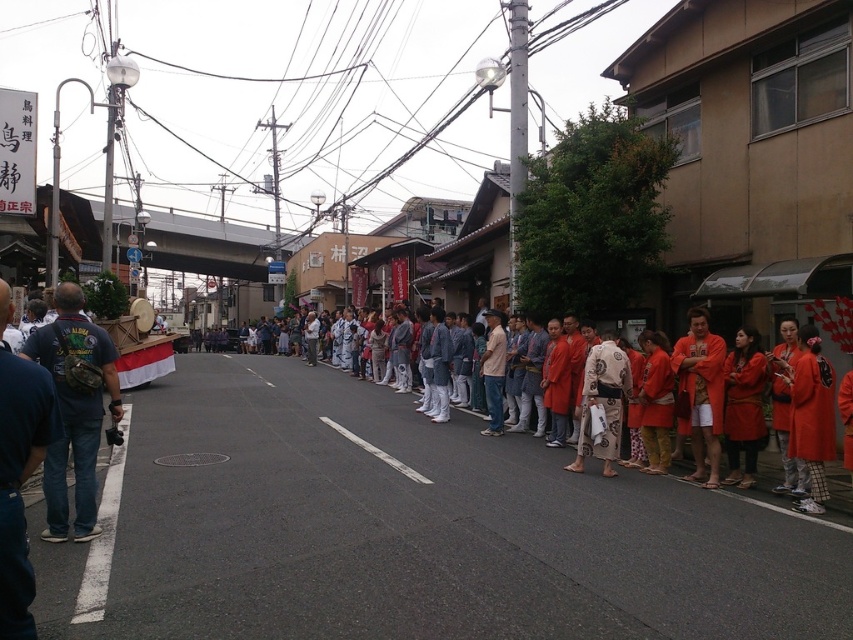
Question: Can you confirm if orange cotton kimono at center is positioned to the right of blue jeans at lower left?

Choices:
 (A) yes
 (B) no

Answer: (A)

Question: Can you confirm if dark blue denim jeans at lower left is positioned to the right of red kimono at center?

Choices:
 (A) yes
 (B) no

Answer: (A)

Question: In this image, where is light brown cotton kimono at center located relative to matte red kimono at right?

Choices:
 (A) left
 (B) right

Answer: (A)

Question: Estimate the real-world distances between objects in this image. Which object is closer to the red velvet kimono at lower right?

Choices:
 (A) dark blue denim jeans at lower left
 (B) red kimono at center
 (C) blue jeans at lower left
 (D) orange kimono at right

Answer: (D)

Question: Which point is closer to the camera taking this photo?

Choices:
 (A) (796, 449)
 (B) (717, 358)

Answer: (A)

Question: Which of the following is the farthest from the observer?

Choices:
 (A) orange cotton kimono at center
 (B) orange cotton kimono at right
 (C) dark blue denim jeans at lower left
 (D) red kimono at center

Answer: (B)